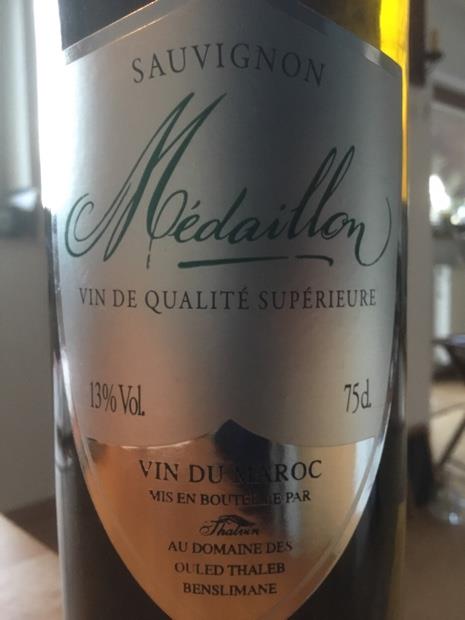
You are a GUI agent. You are given a task and a screenshot of the screen. Output one action in this format:
    pyautogui.click(x=<x>, y=<y>)
    Task: Click on the wine bottle
    
    Given the screenshot: What is the action you would take?
    pyautogui.click(x=366, y=589)